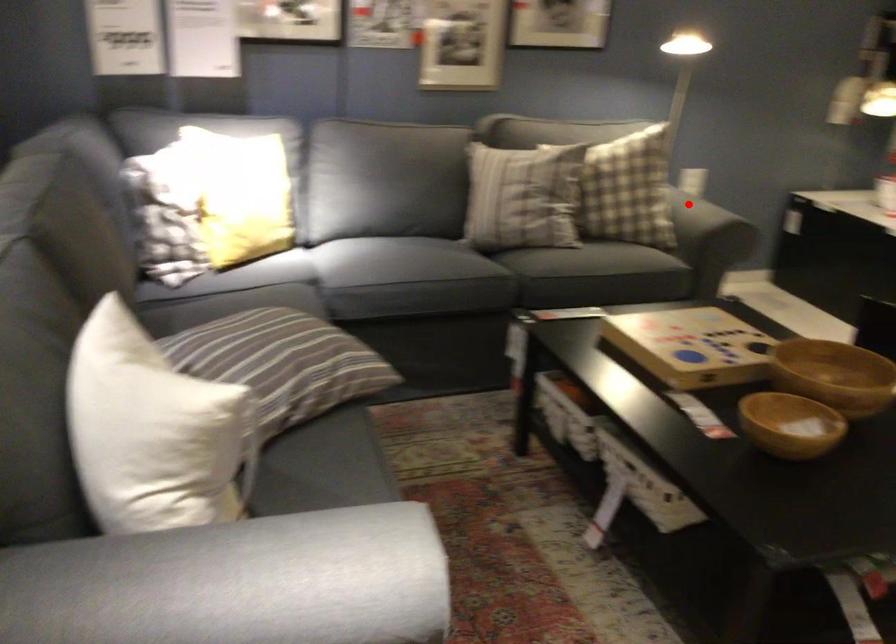
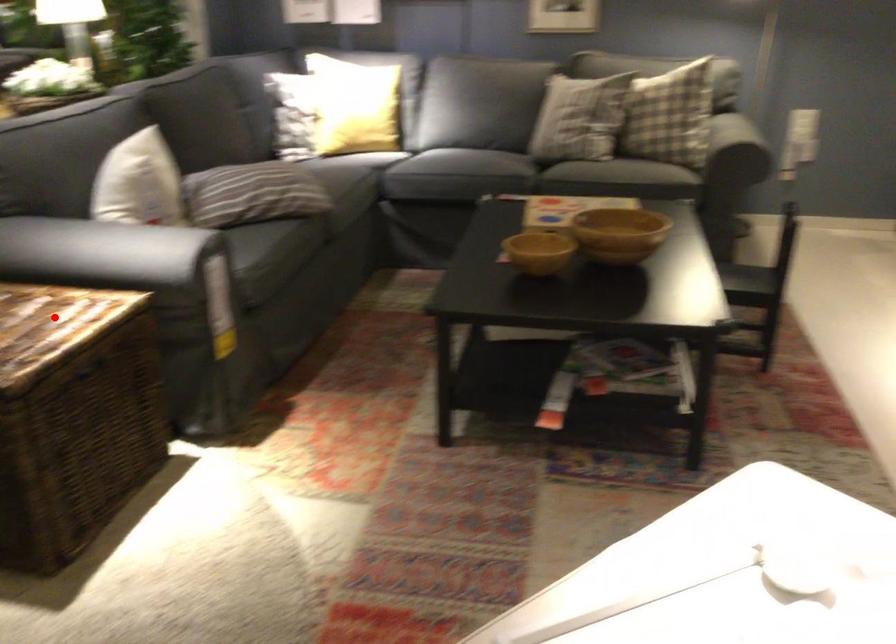
I am providing you with two images of the same scene from different viewpoints. A red point is marked on the first image and another point is marked on the second image. Do the highlighted points in image1 and image2 indicate the same real-world spot?

No